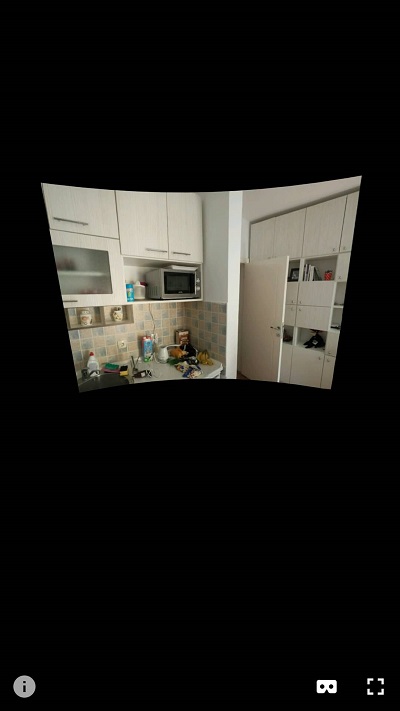
This screenshot has height=711, width=400. I want to click on small beige shelf, so click(101, 321).